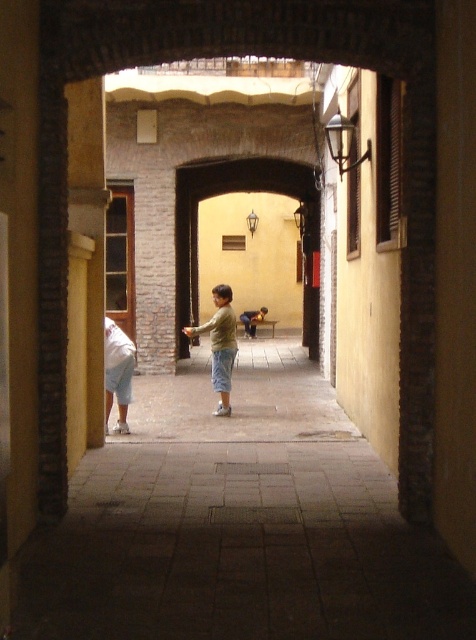
Question: Which point is closer to the camera?

Choices:
 (A) (188, 336)
 (B) (115, 371)

Answer: (B)

Question: Is matte green shirt at center to the left of white cotton pants at left from the viewer's perspective?

Choices:
 (A) no
 (B) yes

Answer: (A)

Question: Which point is farther from the camera taking this photo?

Choices:
 (A) (227, 316)
 (B) (109, 328)

Answer: (A)

Question: Is matte green shirt at center further to camera compared to white cotton pants at left?

Choices:
 (A) yes
 (B) no

Answer: (A)

Question: Can you confirm if matte green shirt at center is smaller than white cotton pants at left?

Choices:
 (A) no
 (B) yes

Answer: (B)